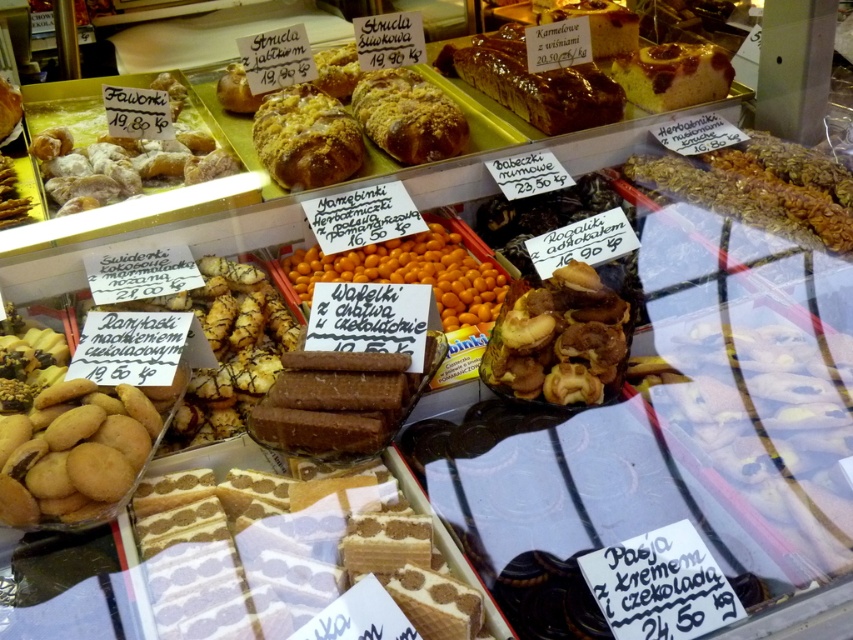
Question: Which object is closer to the camera taking this photo?

Choices:
 (A) golden crumbly loaf at center
 (B) white creamy cake at center
 (C) granular textured nuts at upper right

Answer: (B)

Question: Does golden crumbly bun at upper center appear under golden crumbly loaf at center?

Choices:
 (A) yes
 (B) no

Answer: (A)

Question: Is white creamy cake at center below granular textured nuts at upper right?

Choices:
 (A) no
 (B) yes

Answer: (B)

Question: From the image, what is the correct spatial relationship of orange glossy wafers at center in relation to golden crumbly loaf at center?

Choices:
 (A) below
 (B) above

Answer: (A)

Question: Which object is farther from the camera taking this photo?

Choices:
 (A) golden crispy waffle at center
 (B) golden crumbly loaf at center
 (C) white creamy cake at center

Answer: (B)

Question: Which point is closer to the camera?

Choices:
 (A) orange glossy wafers at center
 (B) golden crumbly loaf at center
 (C) granular textured nuts at upper right

Answer: (A)